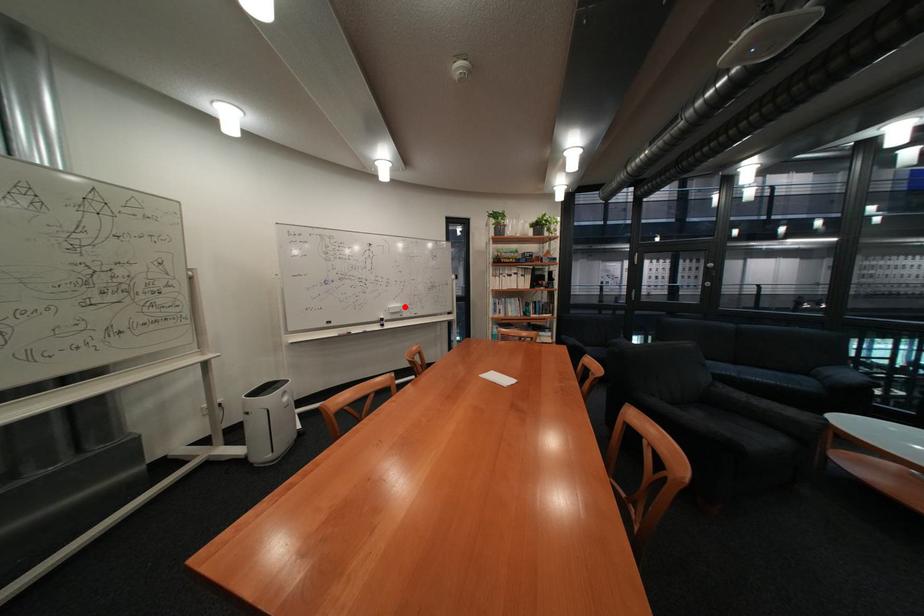
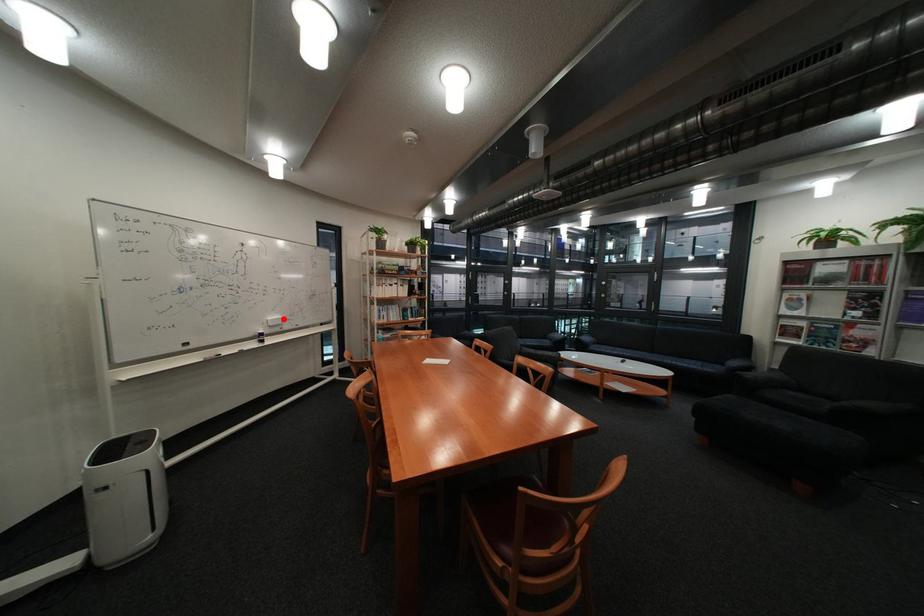
I am providing you with two images of the same scene from different viewpoints. A red point is marked on the first image and another point is marked on the second image. Is the marked point in image1 the same physical position as the marked point in image2?

Yes